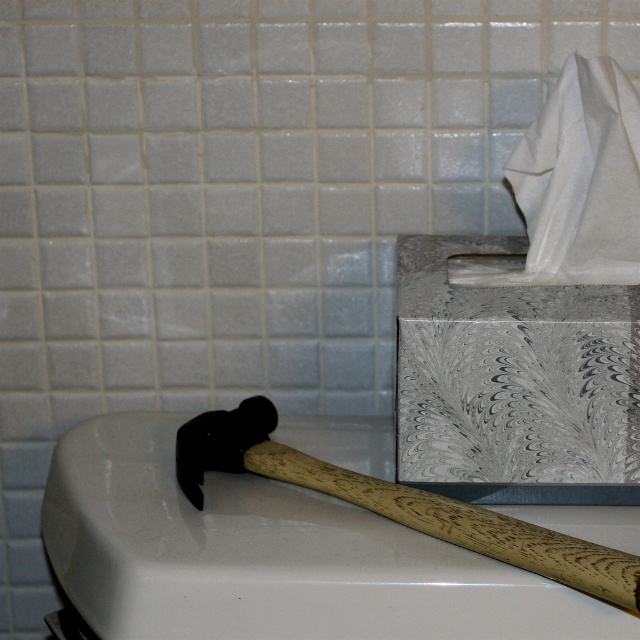
You are organizing items in the bathroom and need to know the position of the white marbled tissue at upper right and the wooden textured hammer at lower left. Which item is placed higher?

The white marbled tissue at upper right is placed higher than the wooden textured hammer at lower left.

You are standing in front of the bathroom sink and need to place a 12 inch ruler between the hammer with a wooden handle on the sink edge and the point at (x=636, y=145). Will the ruler fit between them?

The distance between the hammer with a wooden handle on the sink edge and the point at (x=636, y=145) is 33.91 inches, so the 12 inch ruler will fit between them.

You are standing in a bathroom and see a point at coordinates (532, 316). What is this point located on?

The point at coordinates (532, 316) is located on the white marbled tissue at upper right.